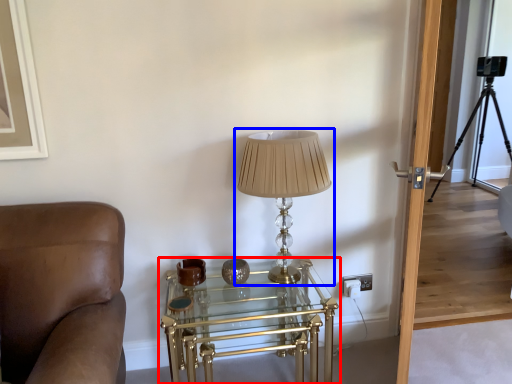
Question: Which object appears farthest to the camera in this image, table (highlighted by a red box) or lamp (highlighted by a blue box)?

Choices:
 (A) table
 (B) lamp

Answer: (A)